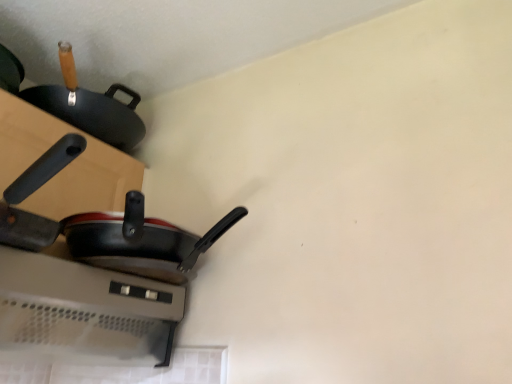
This screenshot has height=384, width=512. Describe the element at coordinates (32, 193) in the screenshot. I see `black matte frying pan at left, the 1th frying pan viewed from the front` at that location.

How much space does black matte frying pan at left, acting as the second frying pan starting from the back, occupy vertically?

black matte frying pan at left, acting as the second frying pan starting from the back, is 2.98 inches tall.

What are the coordinates of `black matte frying pan at left, acting as the second frying pan starting from the back` in the screenshot? It's located at (32, 193).

The height and width of the screenshot is (384, 512). What do you see at coordinates (140, 241) in the screenshot?
I see `black matte frying pan at lower left, the 1th frying pan in the back-to-front sequence` at bounding box center [140, 241].

How much space does black matte frying pan at lower left, the 1th frying pan in the back-to-front sequence, occupy vertically?

black matte frying pan at lower left, the 1th frying pan in the back-to-front sequence, is 4.61 inches tall.

Identify the location of black matte frying pan at lower left, positioned as the second frying pan in front-to-back order. (140, 241).

At what (x,y) coordinates should I click in order to perform the action: click on black matte frying pan at left, acting as the second frying pan starting from the back. Please return your answer as a coordinate pair (x, y). Looking at the image, I should click on (32, 193).

Considering the positions of objects black matte frying pan at lower left, the 1th frying pan in the back-to-front sequence, and black matte frying pan at left, acting as the second frying pan starting from the back, in the image provided, who is more to the left, black matte frying pan at lower left, the 1th frying pan in the back-to-front sequence, or black matte frying pan at left, acting as the second frying pan starting from the back,?

black matte frying pan at left, acting as the second frying pan starting from the back, is more to the left.

Which object is closer to the camera taking this photo, black matte frying pan at lower left, the 1th frying pan in the back-to-front sequence, or black matte frying pan at left, the 1th frying pan viewed from the front?

black matte frying pan at left, the 1th frying pan viewed from the front, is in front.

Is point (148, 220) positioned behind point (49, 239)?

That is True.

From the image's perspective, is black matte frying pan at lower left, the 1th frying pan in the back-to-front sequence, positioned above or below black matte frying pan at left, acting as the second frying pan starting from the back?

From the image's perspective, black matte frying pan at lower left, the 1th frying pan in the back-to-front sequence, appears below black matte frying pan at left, acting as the second frying pan starting from the back.

From a real-world perspective, is black matte frying pan at lower left, the 1th frying pan in the back-to-front sequence, physically located above or below black matte frying pan at left, the 1th frying pan viewed from the front?

Clearly, from a real-world perspective, black matte frying pan at lower left, the 1th frying pan in the back-to-front sequence, is above black matte frying pan at left, the 1th frying pan viewed from the front.

Which of these two, black matte frying pan at lower left, positioned as the second frying pan in front-to-back order, or black matte frying pan at left, acting as the second frying pan starting from the back, is wider?

With larger width is black matte frying pan at lower left, positioned as the second frying pan in front-to-back order.

Looking at this image, does black matte frying pan at lower left, positioned as the second frying pan in front-to-back order, have a greater height compared to black matte frying pan at left, acting as the second frying pan starting from the back?

Yes.

Between black matte frying pan at lower left, the 1th frying pan in the back-to-front sequence, and black matte frying pan at left, the 1th frying pan viewed from the front, which one has smaller size?

black matte frying pan at left, the 1th frying pan viewed from the front.

From the picture: Can black matte frying pan at left, acting as the second frying pan starting from the back, be found inside black matte frying pan at lower left, positioned as the second frying pan in front-to-back order?

No, black matte frying pan at left, acting as the second frying pan starting from the back, is not a part of black matte frying pan at lower left, positioned as the second frying pan in front-to-back order.

Is black matte frying pan at lower left, the 1th frying pan in the back-to-front sequence, not near black matte frying pan at left, acting as the second frying pan starting from the back?

No, black matte frying pan at lower left, the 1th frying pan in the back-to-front sequence, is in close proximity to black matte frying pan at left, acting as the second frying pan starting from the back.

Could you tell me if black matte frying pan at lower left, positioned as the second frying pan in front-to-back order, is facing black matte frying pan at left, the 1th frying pan viewed from the front?

No, black matte frying pan at lower left, positioned as the second frying pan in front-to-back order, is not oriented towards black matte frying pan at left, the 1th frying pan viewed from the front.

Image resolution: width=512 pixels, height=384 pixels. What are the coordinates of `frying pan that appears below the black matte frying pan at left, the 1th frying pan viewed from the front (from the image's perspective)` in the screenshot? It's located at pos(140,241).

Is black matte frying pan at left, the 1th frying pan viewed from the front, at the left side of black matte frying pan at lower left, the 1th frying pan in the back-to-front sequence?

Indeed, black matte frying pan at left, the 1th frying pan viewed from the front, is positioned on the left side of black matte frying pan at lower left, the 1th frying pan in the back-to-front sequence.

Is the position of black matte frying pan at left, the 1th frying pan viewed from the front, more distant than that of black matte frying pan at lower left, the 1th frying pan in the back-to-front sequence?

No.

Which point is more forward, (x=13, y=186) or (x=62, y=230)?

The point (x=13, y=186) is in front.

From the image's perspective, between black matte frying pan at left, acting as the second frying pan starting from the back, and black matte frying pan at lower left, positioned as the second frying pan in front-to-back order, who is located below?

From the image's view, black matte frying pan at lower left, positioned as the second frying pan in front-to-back order, is below.

From the picture: From a real-world perspective, which is physically above, black matte frying pan at left, acting as the second frying pan starting from the back, or black matte frying pan at lower left, positioned as the second frying pan in front-to-back order?

From a 3D spatial view, black matte frying pan at lower left, positioned as the second frying pan in front-to-back order, is above.

Considering the sizes of objects black matte frying pan at left, the 1th frying pan viewed from the front, and black matte frying pan at lower left, the 1th frying pan in the back-to-front sequence, in the image provided, who is wider, black matte frying pan at left, the 1th frying pan viewed from the front, or black matte frying pan at lower left, the 1th frying pan in the back-to-front sequence,?

With larger width is black matte frying pan at lower left, the 1th frying pan in the back-to-front sequence.

In the scene shown: Is black matte frying pan at left, the 1th frying pan viewed from the front, shorter than black matte frying pan at lower left, positioned as the second frying pan in front-to-back order?

Yes.

Looking at this image, considering the sizes of black matte frying pan at left, the 1th frying pan viewed from the front, and black matte frying pan at lower left, positioned as the second frying pan in front-to-back order, in the image, is black matte frying pan at left, the 1th frying pan viewed from the front, bigger or smaller than black matte frying pan at lower left, positioned as the second frying pan in front-to-back order,?

black matte frying pan at left, the 1th frying pan viewed from the front, is smaller than black matte frying pan at lower left, positioned as the second frying pan in front-to-back order.

Is black matte frying pan at left, acting as the second frying pan starting from the back, inside the boundaries of black matte frying pan at lower left, the 1th frying pan in the back-to-front sequence, or outside?

black matte frying pan at left, acting as the second frying pan starting from the back, is spatially situated outside black matte frying pan at lower left, the 1th frying pan in the back-to-front sequence.

From the picture: Is black matte frying pan at left, acting as the second frying pan starting from the back, beside black matte frying pan at lower left, the 1th frying pan in the back-to-front sequence?

No.

Is black matte frying pan at left, acting as the second frying pan starting from the back, positioned with its back to black matte frying pan at lower left, positioned as the second frying pan in front-to-back order?

black matte frying pan at left, acting as the second frying pan starting from the back, is not turned away from black matte frying pan at lower left, positioned as the second frying pan in front-to-back order.

This screenshot has width=512, height=384. Identify the location of frying pan lying in front of the black matte frying pan at lower left, the 1th frying pan in the back-to-front sequence. 32,193.

The width and height of the screenshot is (512, 384). I want to click on frying pan on the right of black matte frying pan at left, the 1th frying pan viewed from the front, so pyautogui.click(x=140, y=241).

At what (x,y) coordinates should I click in order to perform the action: click on frying pan above the black matte frying pan at left, the 1th frying pan viewed from the front (from a real-world perspective). Please return your answer as a coordinate pair (x, y). Looking at the image, I should click on (140, 241).